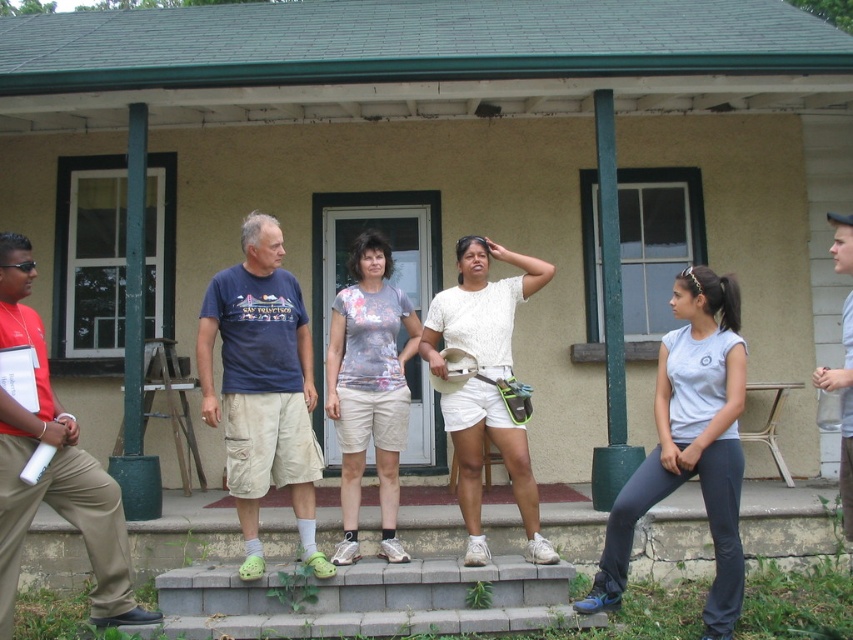
Question: Which object appears closest to the camera in this image?

Choices:
 (A) white cotton shirt at center
 (B) gray concrete stairs at lower center

Answer: (B)

Question: Among these points, which one is farthest from the camera?

Choices:
 (A) (56, 445)
 (B) (711, 458)
 (C) (848, 301)

Answer: (B)

Question: Is gray concrete stairs at lower center wider than gray fabric shirt at center?

Choices:
 (A) no
 (B) yes

Answer: (B)

Question: Is dark blue t-shirt at center positioned behind light blue shirt at center?

Choices:
 (A) no
 (B) yes

Answer: (B)

Question: Which of the following is the farthest from the observer?

Choices:
 (A) floral-patterned fabric shorts at center
 (B) matte khaki shorts at center
 (C) dark blue t-shirt at center
 (D) gray fabric shirt at center

Answer: (A)

Question: Is dark blue t-shirt at center above matte khaki shorts at center?

Choices:
 (A) yes
 (B) no

Answer: (A)